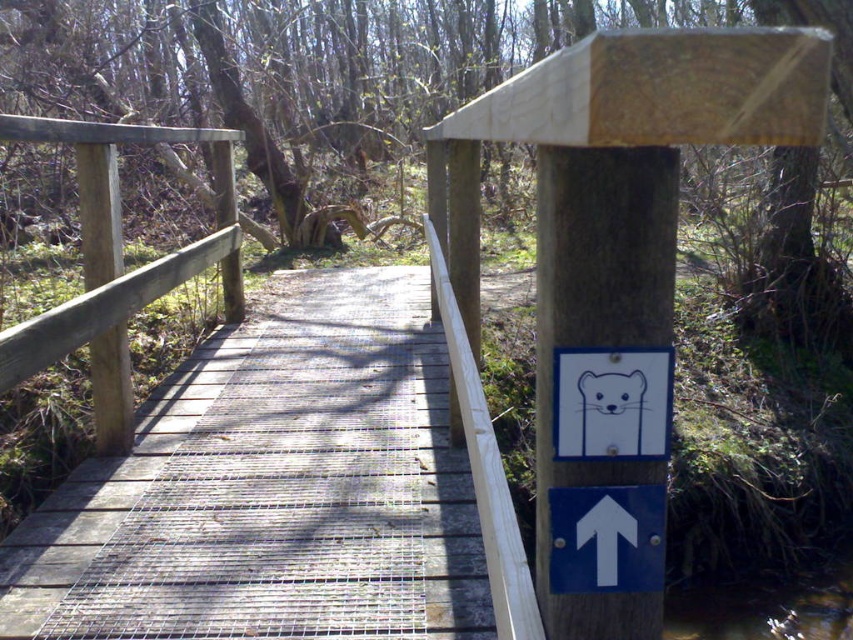
You are standing on the wooden bridge and want to locate the natural wood signpost at upper center. According to the coordinates provided, where exactly is it positioned on the bridge?

The natural wood signpost at upper center is positioned at coordinates point [611,221].